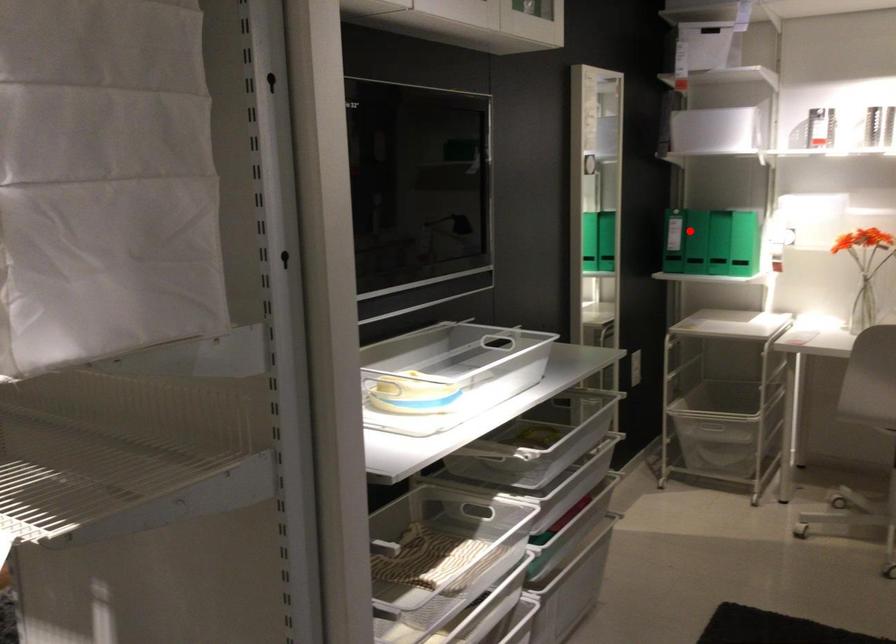
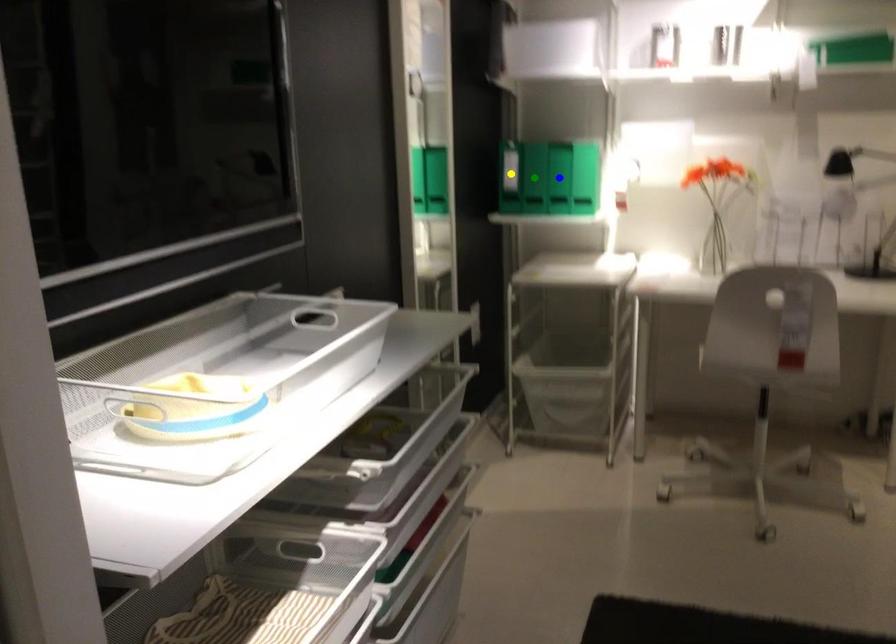
Question: I am providing you with two images of the same scene from different viewpoints. A red point is marked on the first image. You are given multiple points on the second image. Can you choose the point in image 2 that corresponds to the point in image 1?

Choices:
 (A) green point
 (B) blue point
 (C) yellow point

Answer: (C)